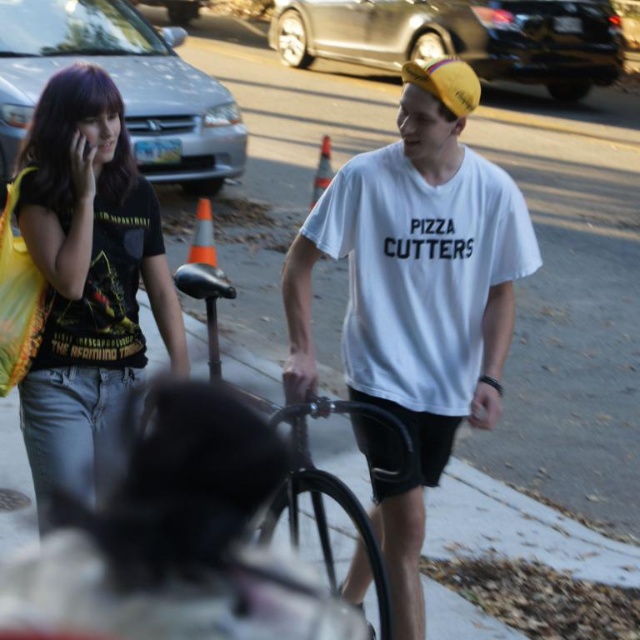
Measure the distance from matte black t-shirt at left to black matte bicycle at center.

matte black t-shirt at left is 22.65 inches from black matte bicycle at center.

The height and width of the screenshot is (640, 640). I want to click on matte black t-shirt at left, so click(x=88, y=282).

The height and width of the screenshot is (640, 640). In order to click on white cotton t-shirt at center in this screenshot , I will do `click(417, 296)`.

Is point (499, 320) positioned behind point (20, 202)?

That is True.

Identify the location of white cotton t-shirt at center. (417, 296).

Can you confirm if white cotton t-shirt at center is thinner than black matte bicycle at center?

Incorrect, white cotton t-shirt at center's width is not less than black matte bicycle at center's.

Does white cotton t-shirt at center have a greater height compared to black matte bicycle at center?

Yes.

Which is behind, point (472, 276) or point (305, 403)?

Positioned behind is point (472, 276).

The height and width of the screenshot is (640, 640). Identify the location of white cotton t-shirt at center. (417, 296).